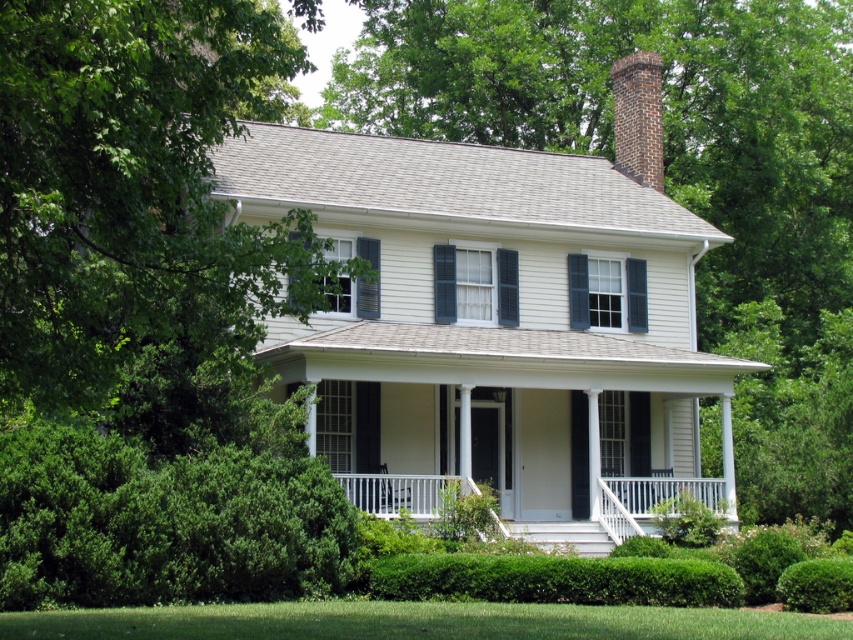
From the picture: You are standing in front of the house and want to know which object is taller between the green leafy tree at center and the white painted wood porch at center. Can you tell me?

The green leafy tree at center is much taller than the white painted wood porch at center.